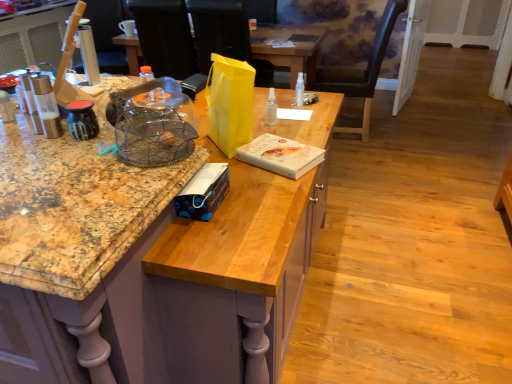
Question: Could you tell me if black matte laptop at center is facing wooden cabinet at center?

Choices:
 (A) no
 (B) yes

Answer: (A)

Question: From the image's perspective, is black matte laptop at center beneath wooden cabinet at center?

Choices:
 (A) no
 (B) yes

Answer: (A)

Question: Can you confirm if black matte laptop at center is positioned to the right of wooden cabinet at center?

Choices:
 (A) no
 (B) yes

Answer: (B)

Question: Does black matte laptop at center contain wooden cabinet at center?

Choices:
 (A) no
 (B) yes

Answer: (A)

Question: Does black matte laptop at center have a lesser width compared to wooden cabinet at center?

Choices:
 (A) yes
 (B) no

Answer: (A)

Question: Is black matte laptop at center oriented away from wooden cabinet at center?

Choices:
 (A) no
 (B) yes

Answer: (A)

Question: Considering the relative sizes of metallic glass salt shaker at left, which is counted as the 1th kitchen appliance, starting from the left, and black matte laptop at center in the image provided, is metallic glass salt shaker at left, which is counted as the 1th kitchen appliance, starting from the left, wider than black matte laptop at center?

Choices:
 (A) yes
 (B) no

Answer: (B)

Question: Does metallic glass salt shaker at left, which is counted as the 1th kitchen appliance, starting from the left, have a greater height compared to black matte laptop at center?

Choices:
 (A) yes
 (B) no

Answer: (A)

Question: Is metallic glass salt shaker at left, which is counted as the second kitchen appliance, starting from the right, aimed at black matte laptop at center?

Choices:
 (A) no
 (B) yes

Answer: (A)

Question: From a real-world perspective, is metallic glass salt shaker at left, which is counted as the 1th kitchen appliance, starting from the left, physically below black matte laptop at center?

Choices:
 (A) no
 (B) yes

Answer: (A)

Question: Considering the relative sizes of metallic glass salt shaker at left, which is counted as the second kitchen appliance, starting from the right, and black matte laptop at center in the image provided, is metallic glass salt shaker at left, which is counted as the second kitchen appliance, starting from the right, thinner than black matte laptop at center?

Choices:
 (A) no
 (B) yes

Answer: (B)

Question: Is metallic glass salt shaker at left, which is counted as the 1th kitchen appliance, starting from the left, in contact with black matte laptop at center?

Choices:
 (A) yes
 (B) no

Answer: (B)

Question: Considering the relative sizes of transparent plastic bottle at center, marked as the 1th bottle in a front-to-back arrangement, and white matte book at center, arranged as the 2th box when viewed from the front, in the image provided, is transparent plastic bottle at center, marked as the 1th bottle in a front-to-back arrangement, wider than white matte book at center, arranged as the 2th box when viewed from the front,?

Choices:
 (A) yes
 (B) no

Answer: (B)